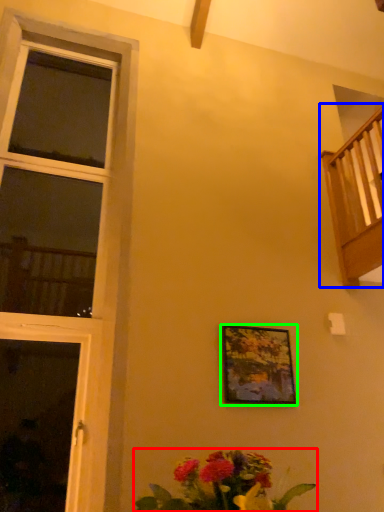
Question: Which is nearer to the floral arrangement (highlighted by a red box)? balcony (highlighted by a blue box) or picture frame (highlighted by a green box).

Choices:
 (A) balcony
 (B) picture frame

Answer: (B)